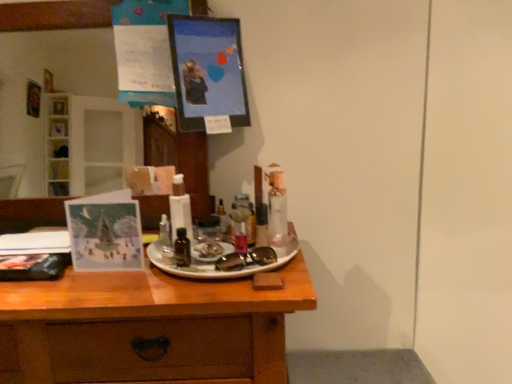
Find the location of a particular element. The width and height of the screenshot is (512, 384). unoccupied space behind black glass bottle at center, positioned as the third toiletry in back-to-front order is located at coordinates (197, 240).